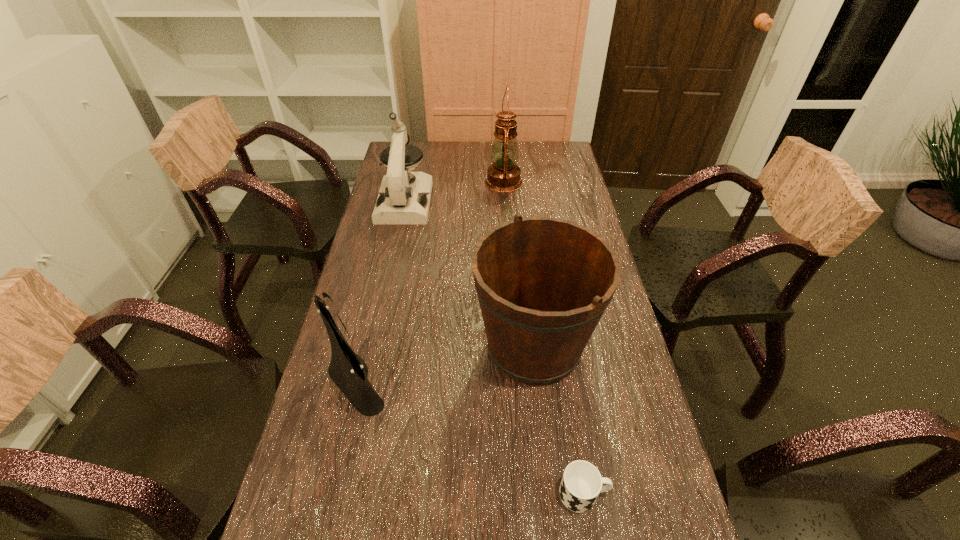
The height and width of the screenshot is (540, 960). I want to click on unoccupied position between the microscope and the oil lamp, so click(x=454, y=192).

Image resolution: width=960 pixels, height=540 pixels. In order to click on free spot between the cup and the bucket in this screenshot , I will do `click(559, 421)`.

The height and width of the screenshot is (540, 960). Identify the location of free space that is in between the bucket and the microscope. (469, 275).

In order to click on vacant point located between the shoulder bag and the microscope in this screenshot , I will do [380, 292].

Image resolution: width=960 pixels, height=540 pixels. In order to click on free space between the microscope and the shoulder bag in this screenshot , I will do `click(380, 292)`.

You are a GUI agent. You are given a task and a screenshot of the screen. Output one action in this format:
    pyautogui.click(x=<x>, y=<y>)
    Task: Click on the object identified as the second closest to the cup
    Image resolution: width=960 pixels, height=540 pixels.
    Given the screenshot: What is the action you would take?
    pyautogui.click(x=361, y=394)

Point out which object is positioned as the nearest to the oil lamp. Please provide its 2D coordinates. Your answer should be formatted as a tuple, i.e. [(x, y)], where the tuple contains the x and y coordinates of a point satisfying the conditions above.

[(404, 197)]

Where is `vacant space that satisfies the following two spatial constraints: 1. on the back side of the shoulder bag; 2. on the left side of the bucket`? This screenshot has height=540, width=960. vacant space that satisfies the following two spatial constraints: 1. on the back side of the shoulder bag; 2. on the left side of the bucket is located at coordinates (363, 348).

You are a GUI agent. You are given a task and a screenshot of the screen. Output one action in this format:
    pyautogui.click(x=<x>, y=<y>)
    Task: Click on the free space in the image that satisfies the following two spatial constraints: 1. at the eyepiece of the bucket; 2. on the left side of the microscope
    This screenshot has width=960, height=540.
    Given the screenshot: What is the action you would take?
    pyautogui.click(x=373, y=348)